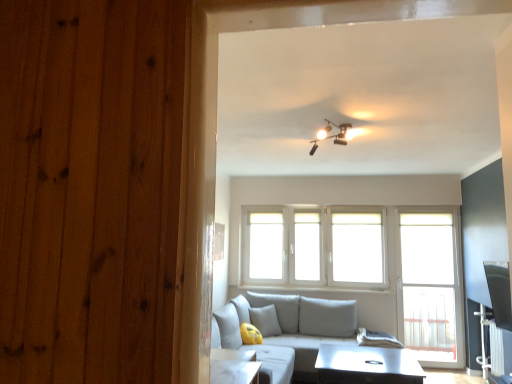
Where is `vacant region above matte black track lights at upper center (from a real-world perspective)`? The image size is (512, 384). vacant region above matte black track lights at upper center (from a real-world perspective) is located at coordinates (324, 121).